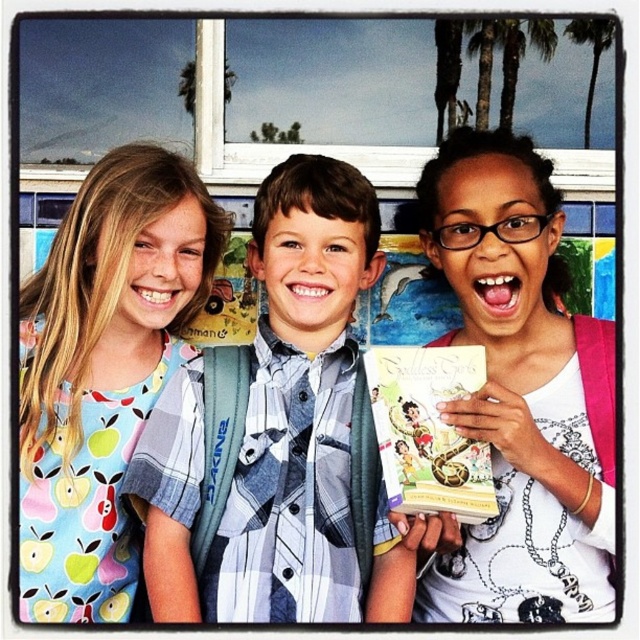
Is printed cotton shirt at left above hardcover book at center?

Correct, printed cotton shirt at left is located above hardcover book at center.

Between printed cotton shirt at left and hardcover book at center, which one appears on the right side from the viewer's perspective?

hardcover book at center is more to the right.

Who is more distant from viewer, (141, 260) or (432, 440)?

The point (141, 260) is behind.

Where is `printed cotton shirt at left`? This screenshot has height=640, width=640. printed cotton shirt at left is located at coordinates (104, 371).

In the scene shown: Between plaid shirt at center and printed cotton shirt at left, which one appears on the left side from the viewer's perspective?

Positioned to the left is printed cotton shirt at left.

Is plaid shirt at center taller than printed cotton shirt at left?

No, plaid shirt at center is not taller than printed cotton shirt at left.

Between point (202, 436) and point (84, 179), which one is positioned in front?

Point (202, 436) is in front.

Find the location of a particular element. This screenshot has width=640, height=640. plaid shirt at center is located at coordinates (282, 433).

Does point (502, 211) come behind point (76, 476)?

That is False.

Is the position of white glossy book at center less distant than that of printed cotton shirt at left?

Yes, it is.

Between point (560, 352) and point (92, 490), which one is positioned in front?

Point (92, 490) is in front.

This screenshot has width=640, height=640. Find the location of `white glossy book at center`. white glossy book at center is located at coordinates (518, 397).